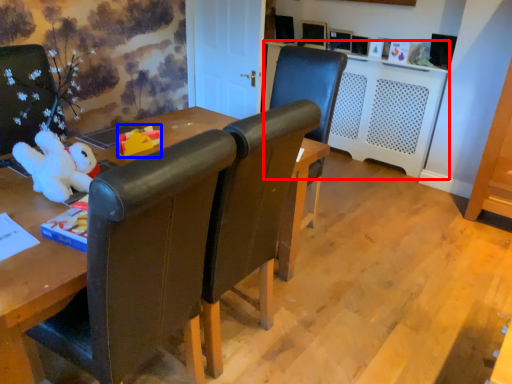
Question: Which object appears farthest to the camera in this image, computer desk (highlighted by a red box) or toy (highlighted by a blue box)?

Choices:
 (A) computer desk
 (B) toy

Answer: (A)